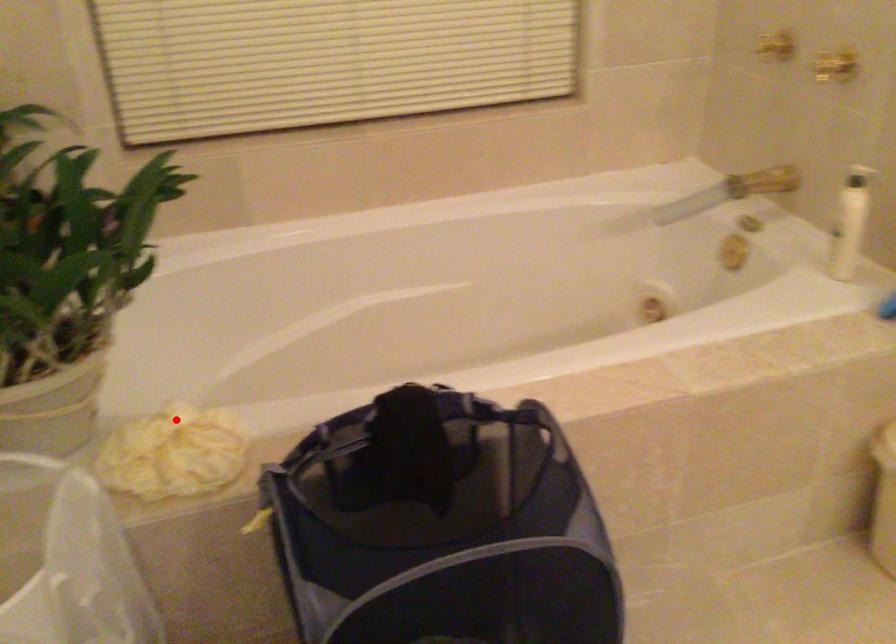
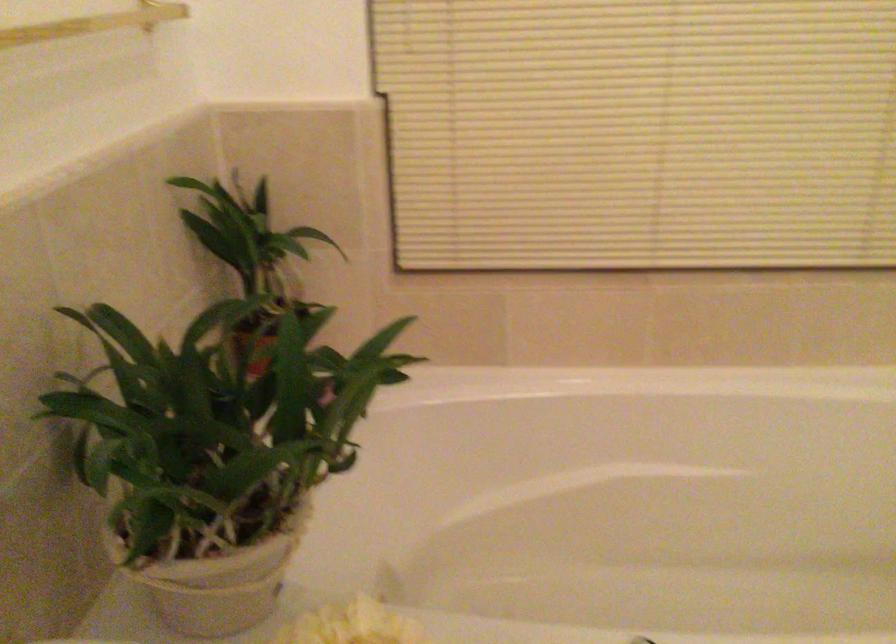
Question: I am providing you with two images of the same scene from different viewpoints. In image1, a red point is highlighted. Considering the same 3D point in image2, which of the following is correct?

Choices:
 (A) It is closer
 (B) It is farther

Answer: (A)